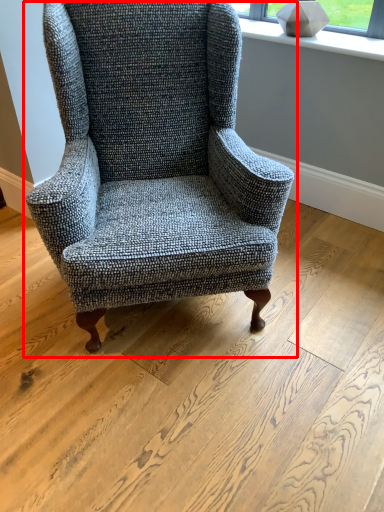
Question: From the image's perspective, where is chair (annotated by the red box) located in relation to window sill in the image?

Choices:
 (A) below
 (B) above

Answer: (A)